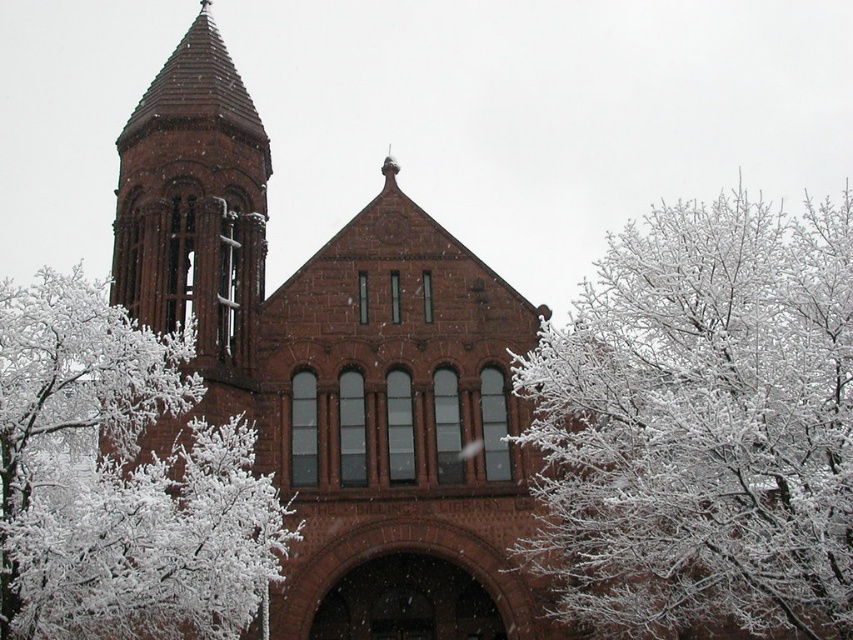
Question: Which point is closer to the camera taking this photo?

Choices:
 (A) (811, 289)
 (B) (39, 368)
 (C) (231, 413)

Answer: (B)

Question: Which of the following is the farthest from the observer?

Choices:
 (A) (54, 572)
 (B) (183, 195)
 (C) (643, 269)

Answer: (B)

Question: Does white frosty branches at upper right appear under white frosty branches at center?

Choices:
 (A) no
 (B) yes

Answer: (A)

Question: Is white frosty branches at upper right above white frosty branches at center?

Choices:
 (A) no
 (B) yes

Answer: (B)

Question: Is white frosty branches at upper right below white frosty branches at center?

Choices:
 (A) yes
 (B) no

Answer: (B)

Question: Which is farther from the matte brick tower at upper left?

Choices:
 (A) white frosty branches at center
 (B) white frosty branches at upper right

Answer: (B)